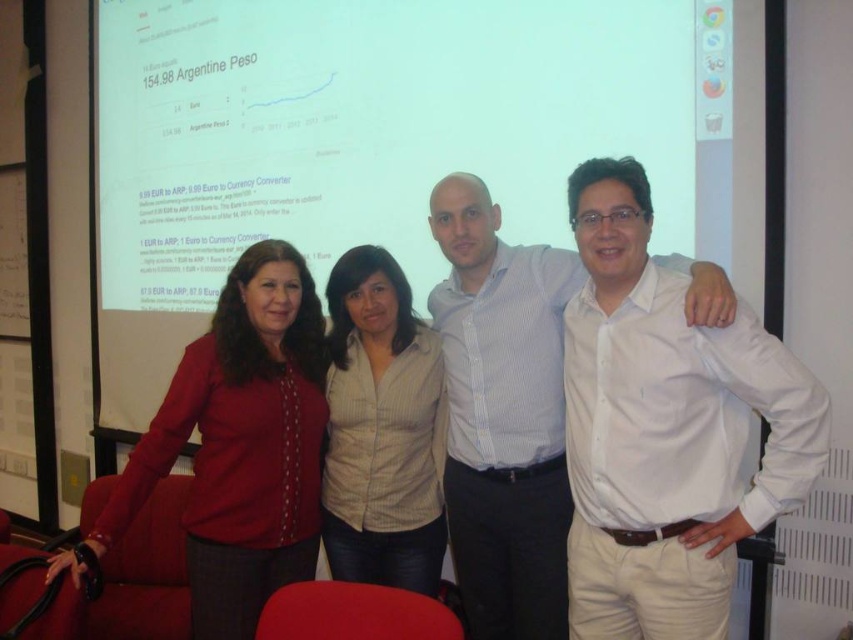
Question: Which object is the closest to the white shirt at center?

Choices:
 (A) matte red blouse at left
 (B) white cotton shirt at right

Answer: (B)

Question: Is white cotton shirt at right smaller than matte red blouse at left?

Choices:
 (A) no
 (B) yes

Answer: (B)

Question: Can you confirm if matte red blouse at left is positioned above white striped shirt at center?

Choices:
 (A) yes
 (B) no

Answer: (B)

Question: Based on their relative distances, which object is nearer to the white striped shirt at center?

Choices:
 (A) matte red blouse at left
 (B) white shirt at center
 (C) white cotton shirt at right

Answer: (B)

Question: Can you confirm if white cotton shirt at right is thinner than matte red blouse at left?

Choices:
 (A) yes
 (B) no

Answer: (A)

Question: Which object is closer to the camera taking this photo?

Choices:
 (A) matte red blouse at left
 (B) white shirt at center
 (C) white striped shirt at center

Answer: (A)